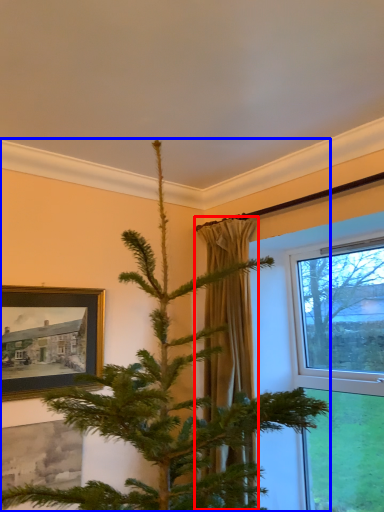
Question: Which point is closer to the camera, curtain (highlighted by a red box) or christmas tree (highlighted by a blue box)?

Choices:
 (A) curtain
 (B) christmas tree

Answer: (B)